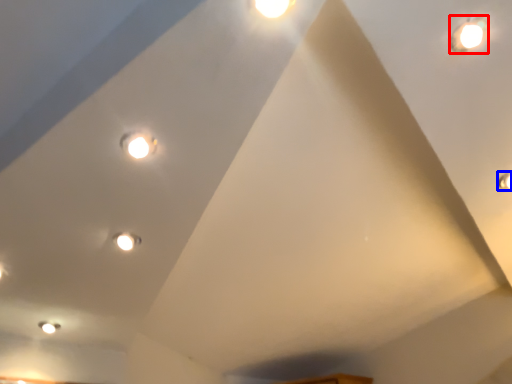
Question: Which of the following is the farthest to the observer, droplight (highlighted by a red box) or light (highlighted by a blue box)?

Choices:
 (A) droplight
 (B) light

Answer: (B)